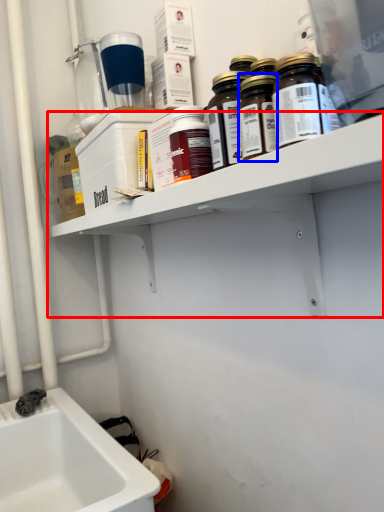
Question: Which of the following is the farthest to the observer, shelf (highlighted by a red box) or bottle (highlighted by a blue box)?

Choices:
 (A) shelf
 (B) bottle

Answer: (B)